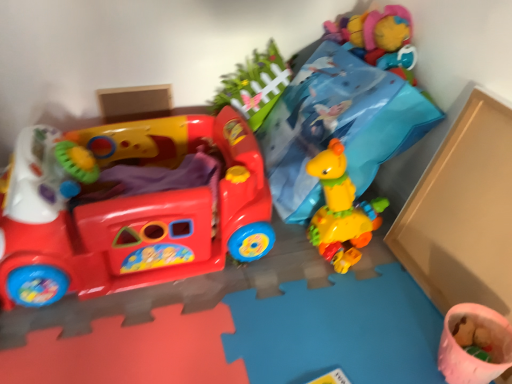
Question: Is pink fabric cup at lower right, which is the second toy in top-to-bottom order, completely or partially outside of matte plastic walker at left, acting as the 1th toy starting from the left?

Choices:
 (A) no
 (B) yes

Answer: (B)

Question: Is pink fabric cup at lower right, the 1th toy viewed from the right, further to camera compared to matte plastic walker at left, acting as the 1th toy starting from the left?

Choices:
 (A) no
 (B) yes

Answer: (B)

Question: Is pink fabric cup at lower right, the 1th toy viewed from the right, oriented towards matte plastic walker at left, the second toy positioned from the bottom?

Choices:
 (A) yes
 (B) no

Answer: (B)

Question: Considering the relative sizes of pink fabric cup at lower right, the 1th toy viewed from the right, and matte plastic walker at left, placed as the 2th toy when sorted from right to left, in the image provided, is pink fabric cup at lower right, the 1th toy viewed from the right, thinner than matte plastic walker at left, placed as the 2th toy when sorted from right to left,?

Choices:
 (A) no
 (B) yes

Answer: (B)

Question: Considering the relative positions of pink fabric cup at lower right, which is the second toy in top-to-bottom order, and matte plastic walker at left, positioned as the first toy in top-to-bottom order, in the image provided, is pink fabric cup at lower right, which is the second toy in top-to-bottom order, to the right of matte plastic walker at left, positioned as the first toy in top-to-bottom order, from the viewer's perspective?

Choices:
 (A) no
 (B) yes

Answer: (B)

Question: Is pink fabric cup at lower right, the second toy viewed from the left, looking in the opposite direction of matte plastic walker at left, acting as the 1th toy starting from the left?

Choices:
 (A) no
 (B) yes

Answer: (A)

Question: From the image's perspective, is matte plastic walker at left, positioned as the first toy in top-to-bottom order, above pink fabric cup at lower right, the 1th toy viewed from the right?

Choices:
 (A) no
 (B) yes

Answer: (B)

Question: Does matte plastic walker at left, acting as the 1th toy starting from the left, touch pink fabric cup at lower right, which is the second toy in top-to-bottom order?

Choices:
 (A) yes
 (B) no

Answer: (B)

Question: Are matte plastic walker at left, acting as the 1th toy starting from the left, and pink fabric cup at lower right, the second toy viewed from the left, located far from each other?

Choices:
 (A) no
 (B) yes

Answer: (A)

Question: Is matte plastic walker at left, placed as the 2th toy when sorted from right to left, to the right of pink fabric cup at lower right, the first toy from the bottom, from the viewer's perspective?

Choices:
 (A) yes
 (B) no

Answer: (B)

Question: Considering the relative sizes of matte plastic walker at left, positioned as the first toy in top-to-bottom order, and pink fabric cup at lower right, the first toy from the bottom, in the image provided, is matte plastic walker at left, positioned as the first toy in top-to-bottom order, smaller than pink fabric cup at lower right, the first toy from the bottom,?

Choices:
 (A) yes
 (B) no

Answer: (B)

Question: Would you say pink fabric cup at lower right, the 1th toy viewed from the right, is part of matte plastic walker at left, positioned as the first toy in top-to-bottom order,'s contents?

Choices:
 (A) yes
 (B) no

Answer: (B)

Question: Which is correct: pink fabric cup at lower right, which is the second toy in top-to-bottom order, is inside matte plastic walker at left, the second toy positioned from the bottom, or outside of it?

Choices:
 (A) outside
 (B) inside

Answer: (A)